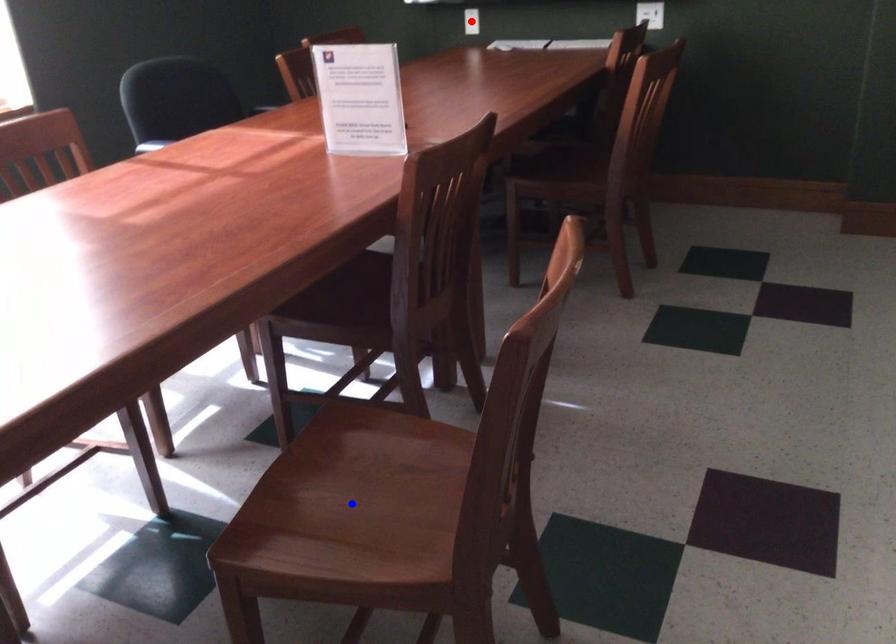
Question: In the image, two points are highlighted. Which point is nearer to the camera? Reply with the corresponding letter.

Choices:
 (A) blue point
 (B) red point

Answer: (A)